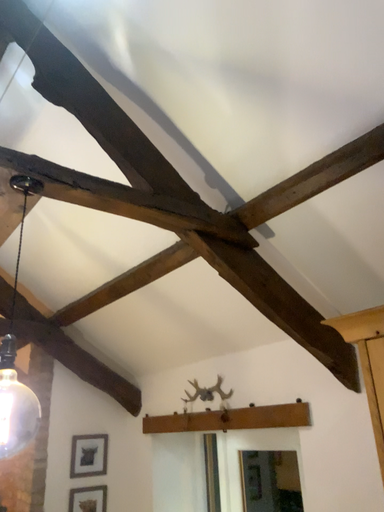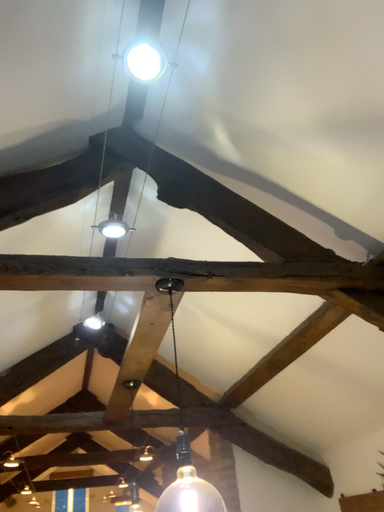
Question: How did the camera likely rotate when shooting the video?

Choices:
 (A) rotated downward
 (B) rotated upward

Answer: (B)